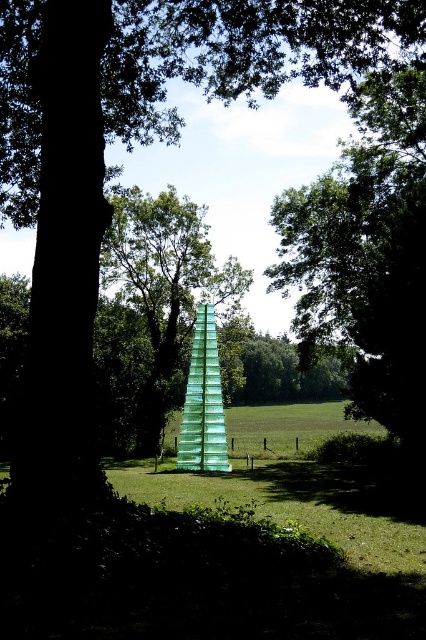
You are standing in the serene outdoor setting described. You notice a point marked at coordinates [160,314]. Which object does this point belong to?

The point at coordinates [160,314] is on the transparent glass tower at center.

You are an artist planning to paint the scene. You want to ensure the green leafy tree at center and the transparent glass tower at center are positioned correctly. Which object should appear larger in your painting to maintain the spatial accuracy?

The green leafy tree at center should appear larger in the painting because it is closer to the viewer than the transparent glass tower at center.